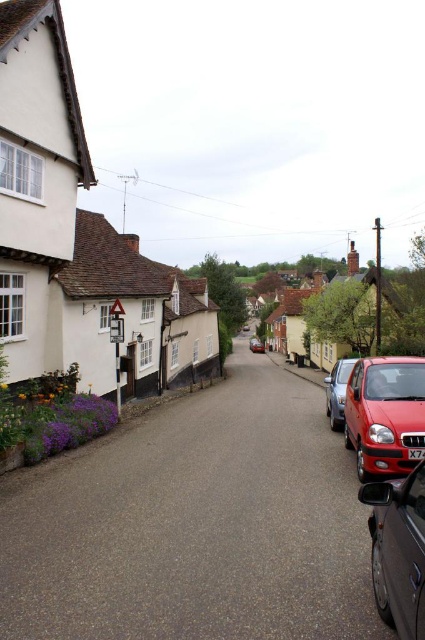
Does shiny red car at right come behind metallic silver car at center?

No, shiny red car at right is in front of metallic silver car at center.

Which is below, shiny red car at right or metallic silver car at center?

metallic silver car at center is lower down.

Describe the element at coordinates (385, 413) in the screenshot. The height and width of the screenshot is (640, 425). I see `shiny red car at right` at that location.

Where is `shiny red car at right`? Image resolution: width=425 pixels, height=640 pixels. shiny red car at right is located at coordinates (x=385, y=413).

Does shiny red car at right have a greater width compared to metallic silver car at right?

No, shiny red car at right is not wider than metallic silver car at right.

Does shiny red car at right have a smaller size compared to metallic silver car at right?

Indeed, shiny red car at right has a smaller size compared to metallic silver car at right.

Locate an element on the screen. shiny red car at right is located at coordinates (385, 413).

Looking at this image, is the position of shiny silver car at lower right more distant than that of black plastic license plate at center?

No.

Does shiny silver car at lower right have a smaller size compared to black plastic license plate at center?

No, shiny silver car at lower right is not smaller than black plastic license plate at center.

Where is `shiny silver car at lower right`? shiny silver car at lower right is located at coordinates (397, 550).